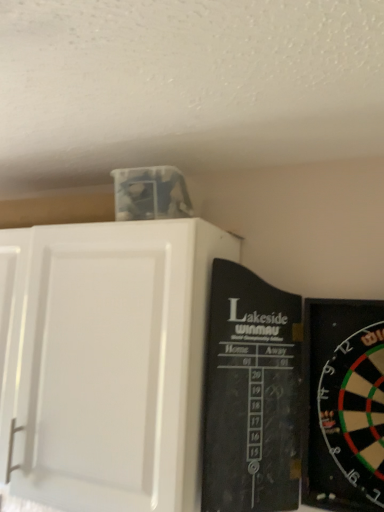
Find the location of `black plastic dartboard at right`. black plastic dartboard at right is located at coordinates (251, 394).

Measure the distance between black plastic dartboard at right and camera.

The distance of black plastic dartboard at right from camera is 98.05 centimeters.

The width and height of the screenshot is (384, 512). What do you see at coordinates (251, 394) in the screenshot? I see `black plastic dartboard at right` at bounding box center [251, 394].

Image resolution: width=384 pixels, height=512 pixels. What do you see at coordinates (114, 364) in the screenshot?
I see `white matte cabinet at upper left` at bounding box center [114, 364].

Locate an element on the screen. white matte cabinet at upper left is located at coordinates (114, 364).

This screenshot has width=384, height=512. What are the coordinates of `black plastic dartboard at right` in the screenshot? It's located at (251, 394).

Between black plastic dartboard at right and white matte cabinet at upper left, which one appears on the left side from the viewer's perspective?

white matte cabinet at upper left.

Considering their positions, is black plastic dartboard at right located in front of or behind white matte cabinet at upper left?

black plastic dartboard at right is in front of white matte cabinet at upper left.

Which is closer, (218, 313) or (92, 267)?

Positioned in front is point (218, 313).

From the image's perspective, which is below, black plastic dartboard at right or white matte cabinet at upper left?

black plastic dartboard at right appears lower in the image.

From a real-world perspective, is black plastic dartboard at right located higher than white matte cabinet at upper left?

No.

Is black plastic dartboard at right wider or thinner than white matte cabinet at upper left?

Considering their sizes, black plastic dartboard at right looks slimmer than white matte cabinet at upper left.

Does black plastic dartboard at right have a greater height compared to white matte cabinet at upper left?

In fact, black plastic dartboard at right may be shorter than white matte cabinet at upper left.

Does black plastic dartboard at right have a smaller size compared to white matte cabinet at upper left?

Yes, black plastic dartboard at right is smaller than white matte cabinet at upper left.

Do you think black plastic dartboard at right is within white matte cabinet at upper left, or outside of it?

The correct answer is: outside.

Are black plastic dartboard at right and white matte cabinet at upper left located far from each other?

black plastic dartboard at right is near white matte cabinet at upper left, not far away.

Is black plastic dartboard at right facing towards white matte cabinet at upper left?

No, black plastic dartboard at right is not turned towards white matte cabinet at upper left.

Can you tell me how much black plastic dartboard at right and white matte cabinet at upper left differ in facing direction?

The angular difference between black plastic dartboard at right and white matte cabinet at upper left is 0.635 degrees.

There is a black plastic dartboard at right. Identify the location of cupboard above it (from a real-world perspective). (114, 364).

Would you say white matte cabinet at upper left is to the left or to the right of black plastic dartboard at right in the picture?

In the image, white matte cabinet at upper left appears on the left side of black plastic dartboard at right.

Is the depth of white matte cabinet at upper left less than that of black plastic dartboard at right?

No, it is behind black plastic dartboard at right.

Which is less distant, (210, 274) or (227, 460)?

Point (210, 274) is positioned farther from the camera compared to point (227, 460).

From the image's perspective, is white matte cabinet at upper left positioned above or below black plastic dartboard at right?

white matte cabinet at upper left is above black plastic dartboard at right.

From a real-world perspective, which is physically above, white matte cabinet at upper left or black plastic dartboard at right?

white matte cabinet at upper left, from a real-world perspective.

Considering the sizes of white matte cabinet at upper left and black plastic dartboard at right in the image, is white matte cabinet at upper left wider or thinner than black plastic dartboard at right?

white matte cabinet at upper left is wider than black plastic dartboard at right.

In the scene shown: Considering the sizes of objects white matte cabinet at upper left and black plastic dartboard at right in the image provided, who is taller, white matte cabinet at upper left or black plastic dartboard at right?

Standing taller between the two is white matte cabinet at upper left.

Can you confirm if white matte cabinet at upper left is smaller than black plastic dartboard at right?

Incorrect, white matte cabinet at upper left is not smaller in size than black plastic dartboard at right.

Can we say white matte cabinet at upper left lies outside black plastic dartboard at right?

white matte cabinet at upper left lies outside black plastic dartboard at right's area.

Is white matte cabinet at upper left beside black plastic dartboard at right?

No, white matte cabinet at upper left is not making contact with black plastic dartboard at right.

Could you tell me if white matte cabinet at upper left is facing black plastic dartboard at right?

No, white matte cabinet at upper left does not turn towards black plastic dartboard at right.

How much distance is there between white matte cabinet at upper left and black plastic dartboard at right?

white matte cabinet at upper left is 20.69 centimeters from black plastic dartboard at right.

At what (x,y) coordinates should I click in order to perform the action: click on bulletin board to the right of white matte cabinet at upper left. Please return your answer as a coordinate pair (x, y). This screenshot has width=384, height=512. Looking at the image, I should click on point(251,394).

What are the coordinates of `cupboard located behind the black plastic dartboard at right` in the screenshot? It's located at (114, 364).

The image size is (384, 512). I want to click on bulletin board on the right of the white matte cabinet at upper left, so click(x=251, y=394).